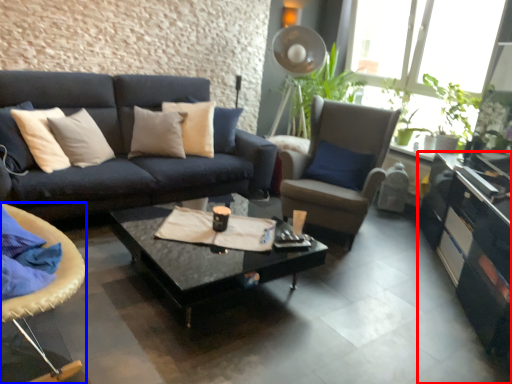
Question: Which object is closer to the camera taking this photo, cabinetry (highlighted by a red box) or chair (highlighted by a blue box)?

Choices:
 (A) cabinetry
 (B) chair

Answer: (B)